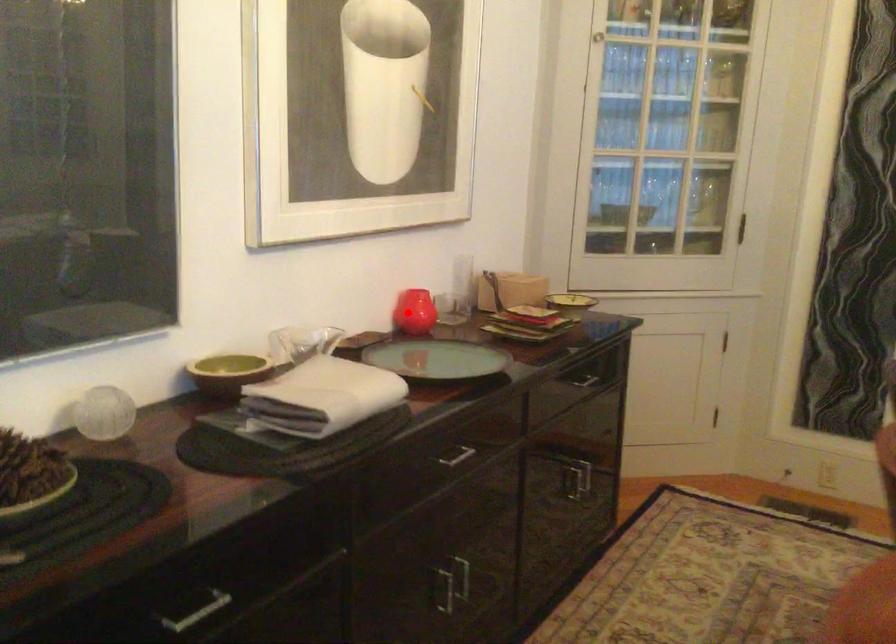
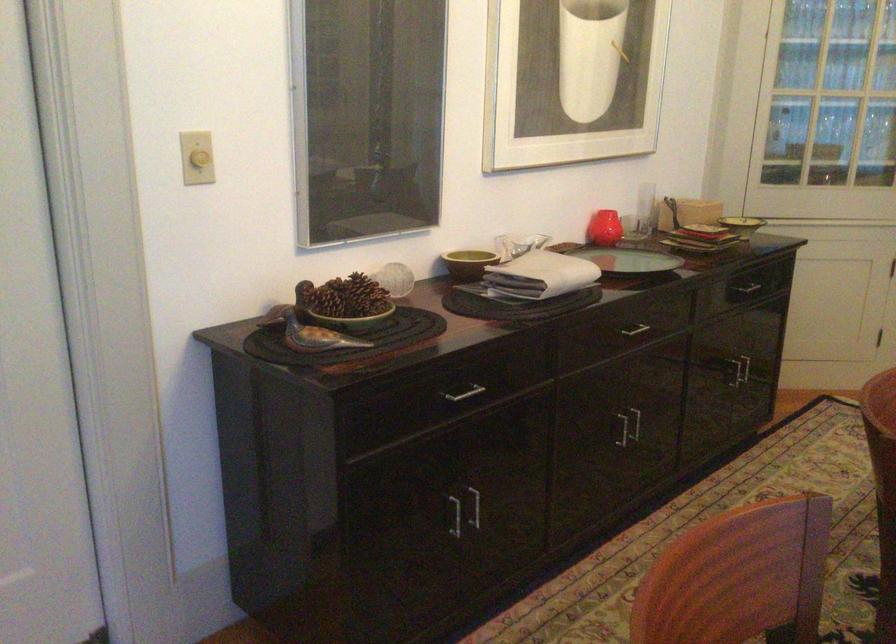
The point at the highlighted location is marked in the first image. Where is the corresponding point in the second image?

(604, 228)